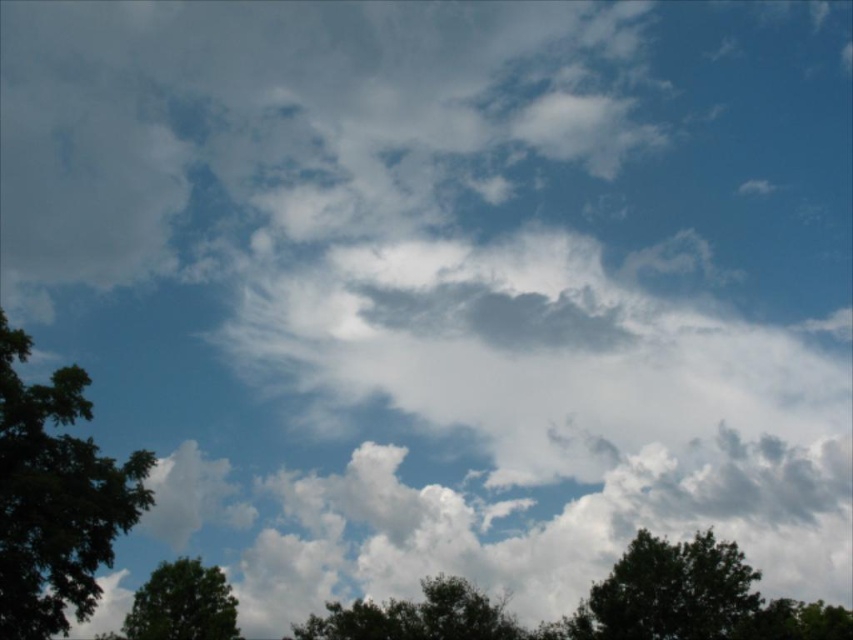
Question: Does dark green leafy tree at lower right have a smaller size compared to green leafy tree at lower left?

Choices:
 (A) no
 (B) yes

Answer: (B)

Question: Which point appears farthest from the camera in this image?

Choices:
 (A) (762, 600)
 (B) (90, 611)
 (C) (363, 634)

Answer: (C)

Question: Which point appears closest to the camera in this image?

Choices:
 (A) (22, 620)
 (B) (201, 573)
 (C) (654, 620)

Answer: (A)

Question: Does green leafy tree at left have a larger size compared to dark green leafy tree at lower right?

Choices:
 (A) yes
 (B) no

Answer: (A)

Question: Does green leafy tree at left appear on the right side of green leafy tree at center?

Choices:
 (A) yes
 (B) no

Answer: (B)

Question: Which point appears closest to the camera in this image?

Choices:
 (A) (640, 579)
 (B) (225, 580)

Answer: (A)